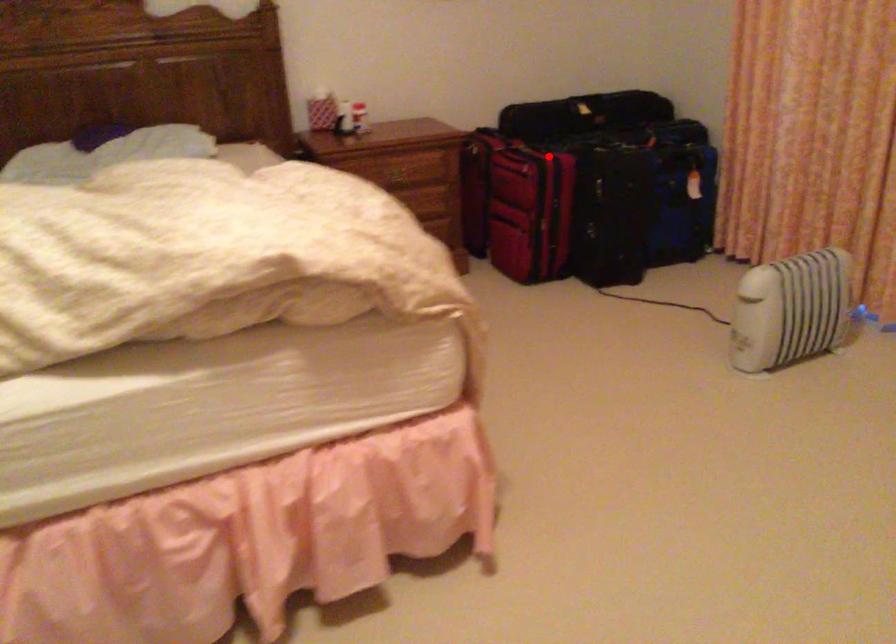
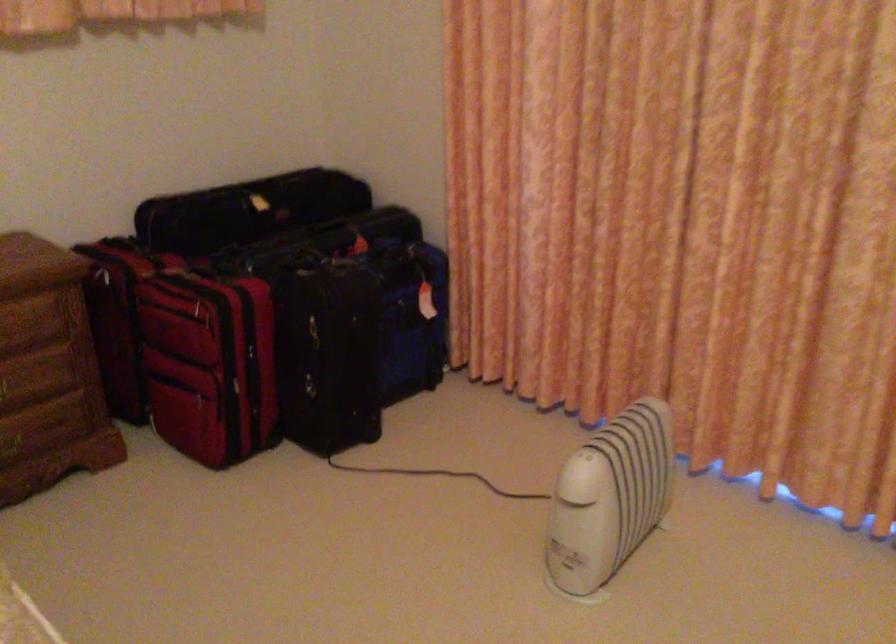
Question: I am providing you with two images of the same scene from different viewpoints. In image1, a red point is highlighted. Considering the same 3D point in image2, which of the following is correct?

Choices:
 (A) It is closer
 (B) It is farther

Answer: (A)